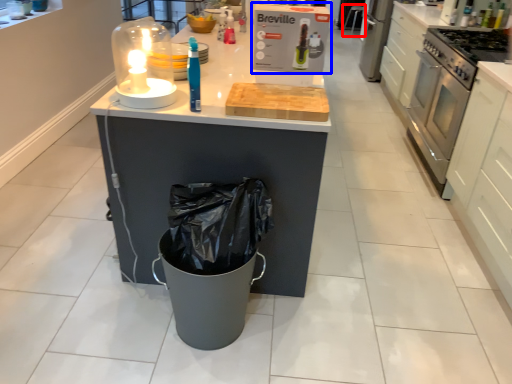
Question: Which point is closer to the camera, bar stool (highlighted by a red box) or kitchen appliance (highlighted by a blue box)?

Choices:
 (A) bar stool
 (B) kitchen appliance

Answer: (B)